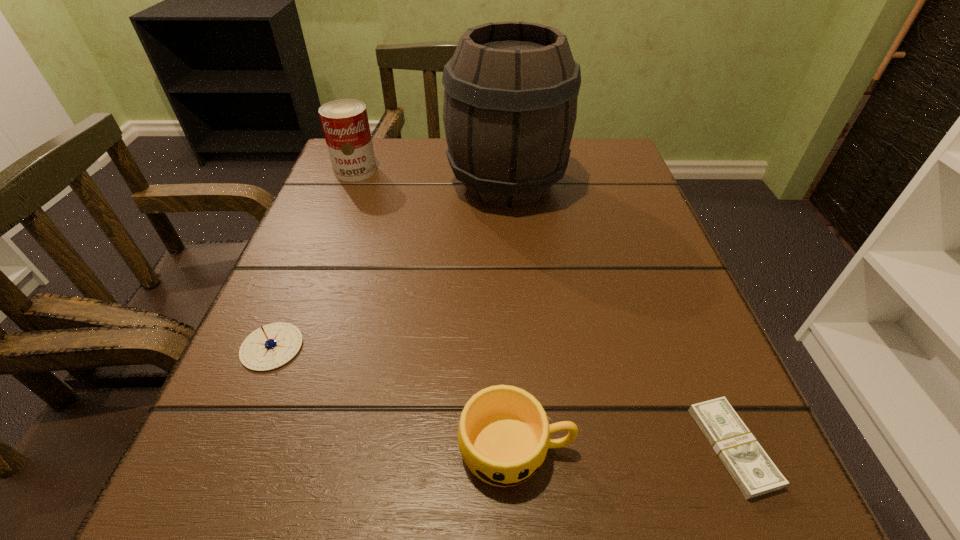
What are the coordinates of `free spot between the compass and the second tallest object` in the screenshot? It's located at (314, 259).

Identify the location of vacant area between the tallest object and the rightmost object. This screenshot has width=960, height=540. (619, 315).

Locate an element on the screen. This screenshot has height=540, width=960. vacant space that is in between the second shortest object and the fourth shortest object is located at coordinates (314, 259).

Find the location of a particular element. Image resolution: width=960 pixels, height=540 pixels. unoccupied area between the third nearest object and the tallest object is located at coordinates (390, 265).

What are the coordinates of `the second closest object to the shortest object` in the screenshot? It's located at (510, 101).

You are a GUI agent. You are given a task and a screenshot of the screen. Output one action in this format:
    pyautogui.click(x=<x>, y=<y>)
    Task: Click on the object that can be found as the fourth closest to the third farthest object
    This screenshot has width=960, height=540.
    Given the screenshot: What is the action you would take?
    pyautogui.click(x=749, y=465)

The height and width of the screenshot is (540, 960). What are the coordinates of `blank space that satisfies the following two spatial constraints: 1. on the front label of the can; 2. on the right side of the third shortest object` in the screenshot? It's located at (247, 449).

The image size is (960, 540). I want to click on free space that satisfies the following two spatial constraints: 1. on the front side of the tallest object; 2. on the right side of the rightmost object, so [528, 447].

The width and height of the screenshot is (960, 540). Identify the location of free location that satisfies the following two spatial constraints: 1. on the front label of the third tallest object; 2. on the left side of the fourth shortest object. (247, 449).

Where is `free spot that satisfies the following two spatial constraints: 1. on the front label of the second tallest object; 2. on the left side of the shortest object`? Image resolution: width=960 pixels, height=540 pixels. free spot that satisfies the following two spatial constraints: 1. on the front label of the second tallest object; 2. on the left side of the shortest object is located at coordinates (248, 447).